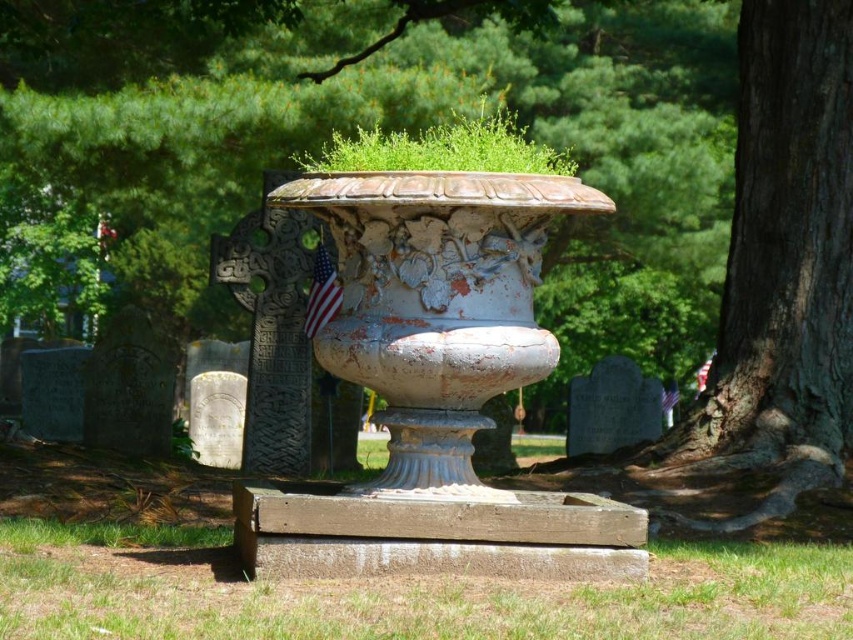
Between green grass at lower center and distressed white vase at center, which one is positioned higher?

distressed white vase at center

The height and width of the screenshot is (640, 853). Find the location of `green grass at lower center`. green grass at lower center is located at coordinates (405, 595).

Between point (224, 602) and point (323, 259), which one is positioned in front?

Positioned in front is point (224, 602).

Is green grass at lower center bigger than american flag at center?

Yes, green grass at lower center is bigger than american flag at center.

What do you see at coordinates (405, 595) in the screenshot? I see `green grass at lower center` at bounding box center [405, 595].

This screenshot has width=853, height=640. Identify the location of green grass at lower center. (405, 595).

Describe the element at coordinates (413, 128) in the screenshot. This screenshot has width=853, height=640. I see `smooth gray bark at center right` at that location.

Which is behind, point (347, 106) or point (339, 301)?

The point (347, 106) is more distant.

You are a GUI agent. You are given a task and a screenshot of the screen. Output one action in this format:
    pyautogui.click(x=<x>, y=<y>)
    Task: Click on the smooth gray bark at center right
    This screenshot has height=640, width=853.
    Given the screenshot: What is the action you would take?
    pyautogui.click(x=413, y=128)